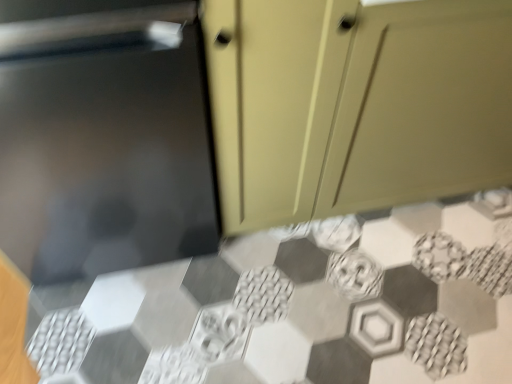
Question: Considering the positions of hexagonal mosaic tile at center and matte beige cabinet at upper right in the image, is hexagonal mosaic tile at center taller or shorter than matte beige cabinet at upper right?

Choices:
 (A) tall
 (B) short

Answer: (B)

Question: Is point click(x=123, y=329) closer or farther from the camera than point click(x=286, y=218)?

Choices:
 (A) closer
 (B) farther

Answer: (A)

Question: Looking at their shapes, would you say hexagonal mosaic tile at center is wider or thinner than matte beige cabinet at upper right?

Choices:
 (A) thin
 (B) wide

Answer: (B)

Question: In the image, is matte beige cabinet at upper right on the left side or the right side of hexagonal mosaic tile at center?

Choices:
 (A) left
 (B) right

Answer: (B)

Question: Considering their positions, is matte beige cabinet at upper right located in front of or behind hexagonal mosaic tile at center?

Choices:
 (A) behind
 (B) front

Answer: (B)

Question: Based on their sizes in the image, would you say matte beige cabinet at upper right is bigger or smaller than hexagonal mosaic tile at center?

Choices:
 (A) small
 (B) big

Answer: (B)

Question: From the image's perspective, relative to hexagonal mosaic tile at center, is matte beige cabinet at upper right above or below?

Choices:
 (A) above
 (B) below

Answer: (A)